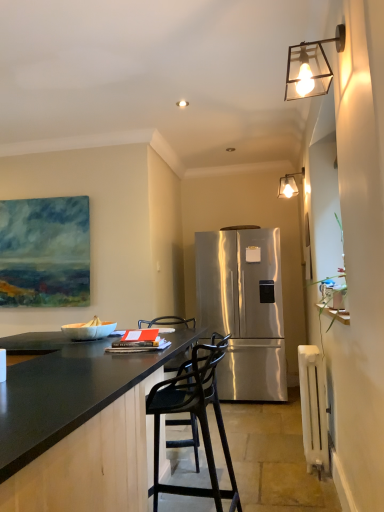
Question: Considering the relative sizes of metallic glass lampshade at upper right, which ranks as the second lamp in front-to-back order, and white painted radiator at lower right in the image provided, is metallic glass lampshade at upper right, which ranks as the second lamp in front-to-back order, bigger than white painted radiator at lower right?

Choices:
 (A) yes
 (B) no

Answer: (B)

Question: Does metallic glass lampshade at upper right, which ranks as the second lamp in front-to-back order, appear on the right side of white painted radiator at lower right?

Choices:
 (A) no
 (B) yes

Answer: (B)

Question: From a real-world perspective, is metallic glass lampshade at upper right, which ranks as the 2th lamp in left-to-right order, on white painted radiator at lower right?

Choices:
 (A) no
 (B) yes

Answer: (B)

Question: Is there a large distance between metallic glass lampshade at upper right, the 1th lamp from the back, and white painted radiator at lower right?

Choices:
 (A) yes
 (B) no

Answer: (A)

Question: Does metallic glass lampshade at upper right, which ranks as the 2th lamp in left-to-right order, come in front of white painted radiator at lower right?

Choices:
 (A) yes
 (B) no

Answer: (B)

Question: Considering their positions, is black matte bar stool at center located in front of or behind metallic glass wall sconce at upper right, arranged as the 1th lamp when viewed from the front?

Choices:
 (A) front
 (B) behind

Answer: (B)

Question: From a real-world perspective, is black matte bar stool at center above or below metallic glass wall sconce at upper right, arranged as the 1th lamp when viewed from the front?

Choices:
 (A) above
 (B) below

Answer: (B)

Question: Is point (175, 408) closer or farther from the camera than point (337, 30)?

Choices:
 (A) farther
 (B) closer

Answer: (A)

Question: Is black matte bar stool at center wider or thinner than metallic glass wall sconce at upper right, arranged as the 1th lamp when viewed from the front?

Choices:
 (A) wide
 (B) thin

Answer: (A)

Question: Is point (331, 74) positioned closer to the camera than point (82, 357)?

Choices:
 (A) closer
 (B) farther

Answer: (A)

Question: From a real-world perspective, is metallic glass wall sconce at upper right, arranged as the 1th lamp when viewed from the front, positioned above or below black granite countertop at center?

Choices:
 (A) below
 (B) above

Answer: (B)

Question: Is metallic glass wall sconce at upper right, which appears as the second lamp when viewed from the right, taller or shorter than black granite countertop at center?

Choices:
 (A) tall
 (B) short

Answer: (B)

Question: Is metallic glass wall sconce at upper right, which appears as the first lamp when viewed from the left, in front of or behind black granite countertop at center in the image?

Choices:
 (A) front
 (B) behind

Answer: (A)

Question: From their relative heights in the image, would you say black matte bar stool at center is taller or shorter than white painted radiator at lower right?

Choices:
 (A) tall
 (B) short

Answer: (A)

Question: Based on their sizes in the image, would you say black matte bar stool at center is bigger or smaller than white painted radiator at lower right?

Choices:
 (A) small
 (B) big

Answer: (B)